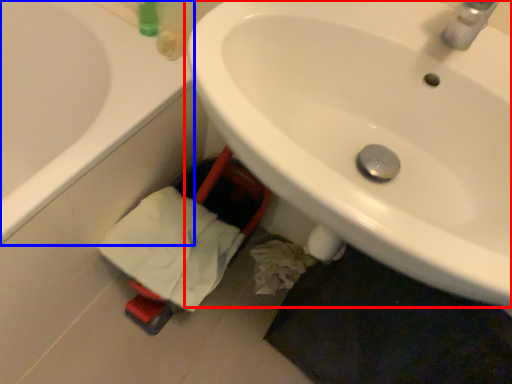
Question: Among these objects, which one is nearest to the camera, sink (highlighted by a red box) or bathtub (highlighted by a blue box)?

Choices:
 (A) sink
 (B) bathtub

Answer: (A)